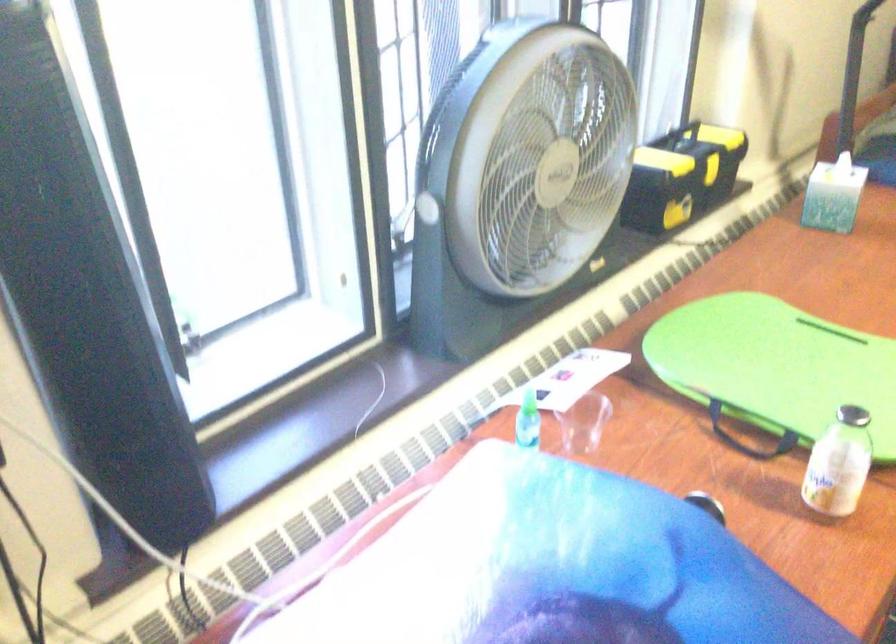
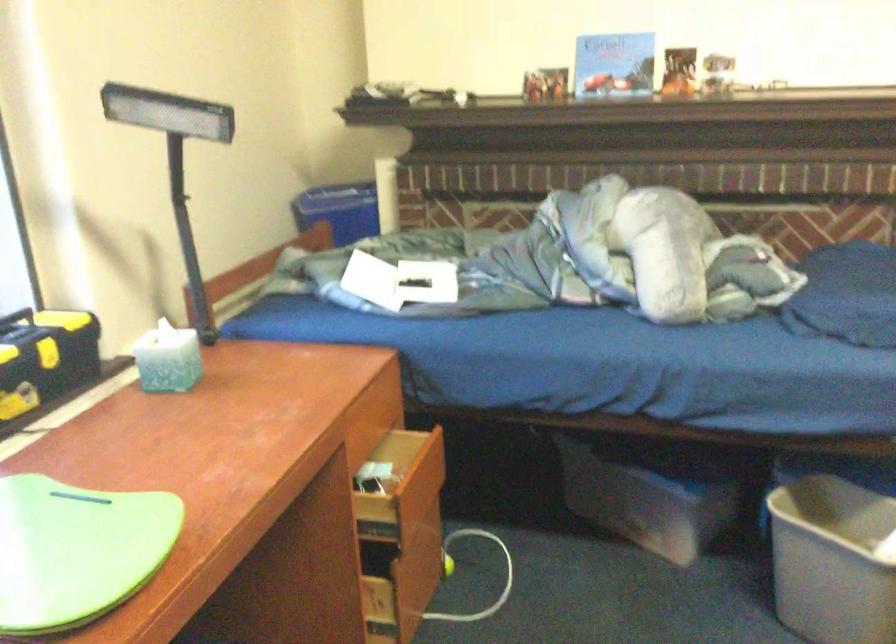
Find the pixel in the second image that matches the point at 703,174 in the first image.

(46, 354)